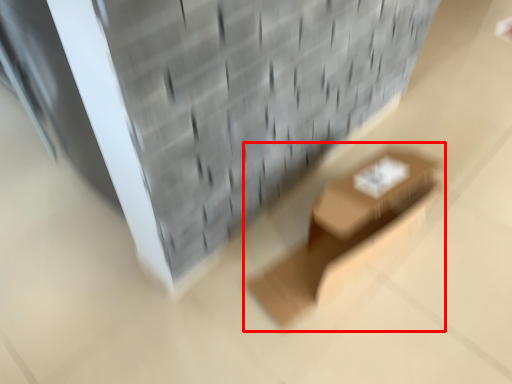
Question: From the image's perspective, where is furniture (annotated by the red box) located relative to brickwork?

Choices:
 (A) above
 (B) below

Answer: (B)